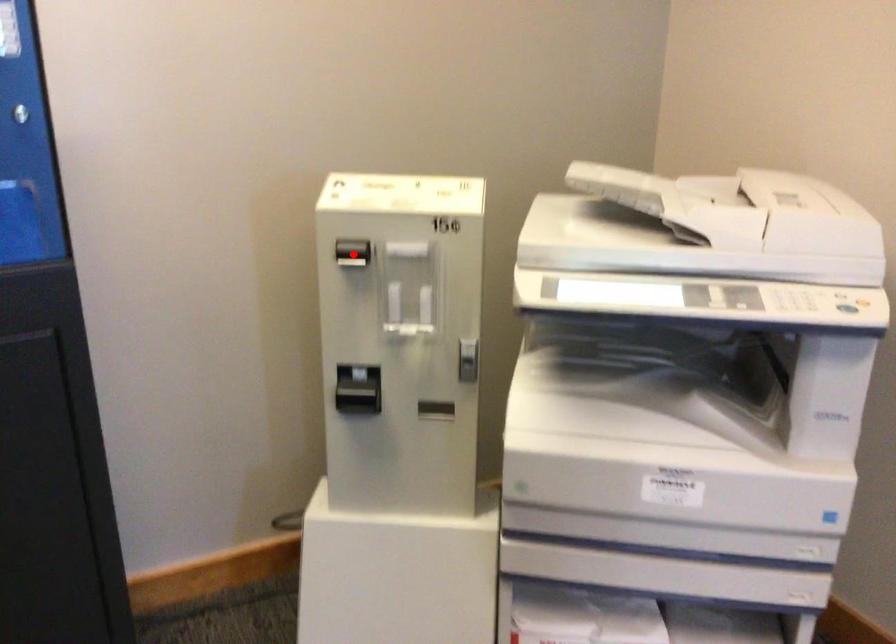
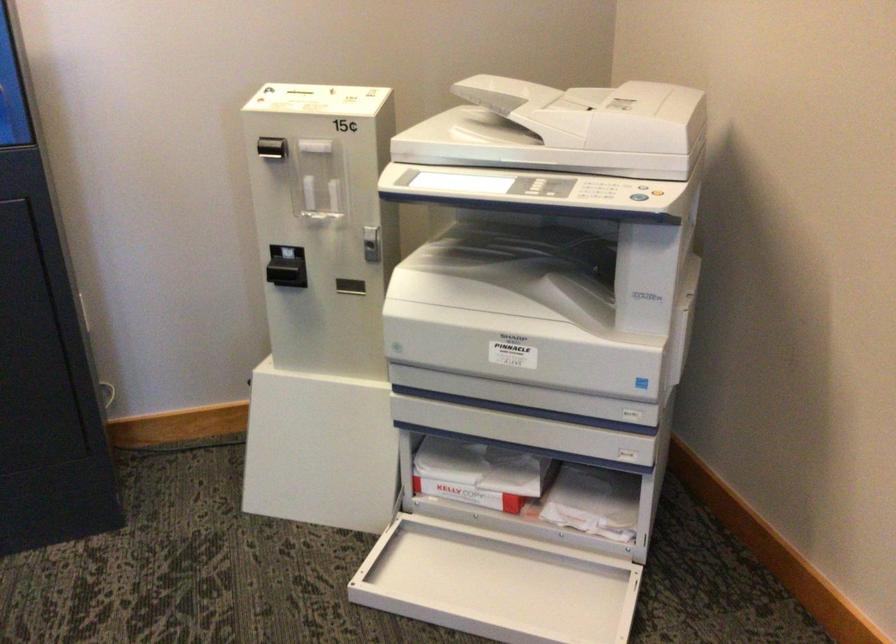
Locate, in the second image, the point that corresponds to the highlighted location in the first image.

(271, 147)